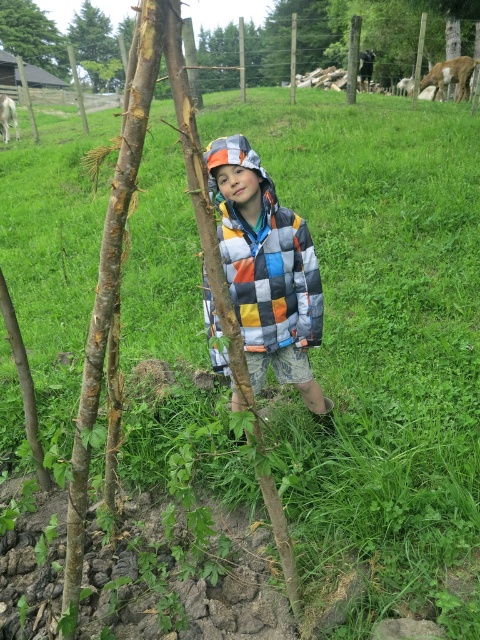
You are a landscape architect designing a garden layout. You need to place a new bench that requires at least 2 meters of space between it and any trees. Given the smooth brown tree trunk at upper left and the green textured tree at upper left, which tree should the bench be placed farther from to comply with the spacing requirement?

The bench should be placed farther from the smooth brown tree trunk at upper left because its width is greater than the green textured tree at upper left, requiring more space to comply with the 2 meters requirement.

You are a photographer taking a picture of the scene. You notice the patchwork quilted jacket at center and the smooth brown tree trunk at upper left. Which object is positioned closer to the camera?

The patchwork quilted jacket at center is closer to the viewer than the smooth brown tree trunk at upper left, so it is positioned closer to the camera.